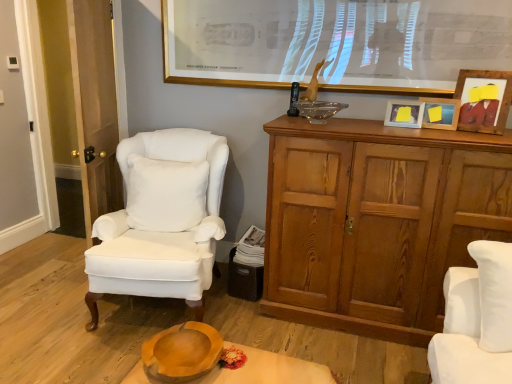
Question: Is transparent glass bowl at upper center inside the boundaries of transparent glass door at left, or outside?

Choices:
 (A) outside
 (B) inside

Answer: (A)

Question: Looking at the image, does transparent glass bowl at upper center seem bigger or smaller compared to transparent glass door at left?

Choices:
 (A) small
 (B) big

Answer: (A)

Question: Based on their relative distances, which object is farther from the white fabric chair at left, which is the first chair from back to front?

Choices:
 (A) transparent glass door at left
 (B) wooden cabinet at right
 (C) white matte picture frame at upper right, positioned as the 3th picture frame in right-to-left order
 (D) transparent glass bowl at upper center
 (E) gold-framed picture at upper center, which appears as the fourth picture frame when viewed from the right

Answer: (C)

Question: Based on their relative distances, which object is nearer to the wooden bowl at lower center?

Choices:
 (A) transparent glass door at left
 (B) gold-framed picture at upper center, which appears as the fourth picture frame when viewed from the right
 (C) white fabric chair at left, which is the first chair from back to front
 (D) transparent glass bowl at upper center
 (E) white velvet pillow at center

Answer: (C)